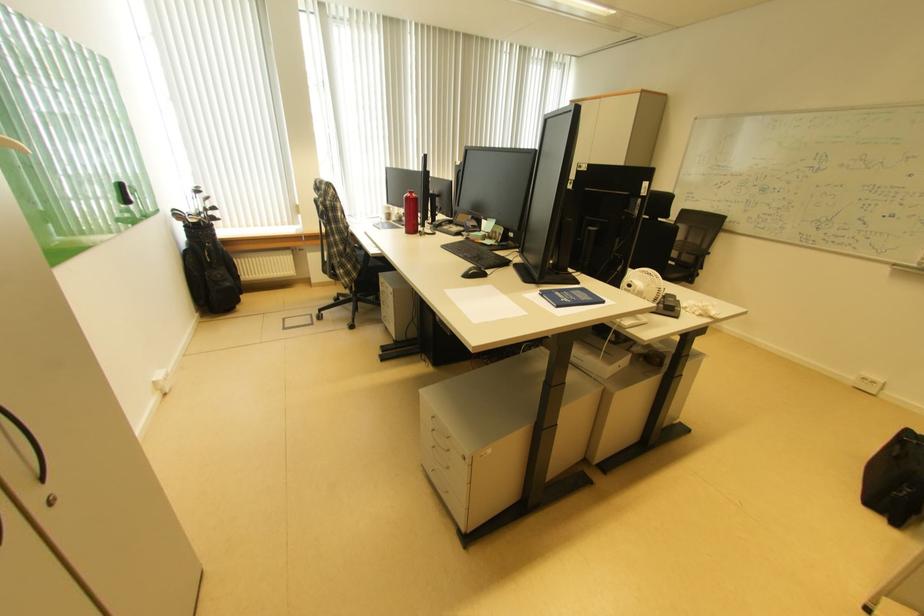
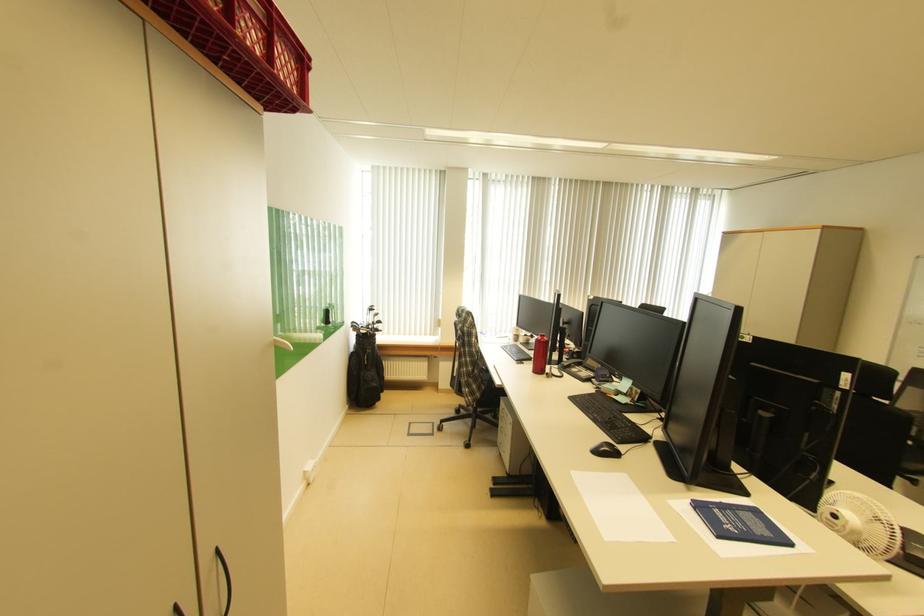
Question: The images are taken continuously from a first-person perspective. In which direction is your viewpoint rotating?

Choices:
 (A) Left
 (B) Right
 (C) Up
 (D) Down

Answer: (A)